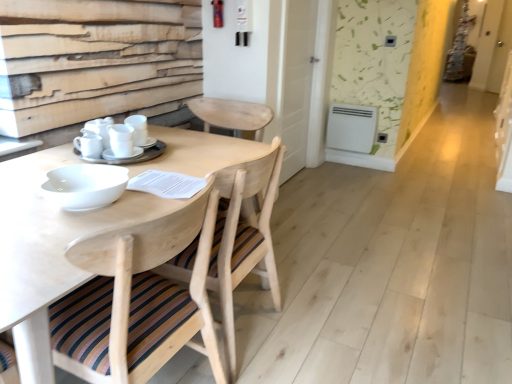
Describe the element at coordinates (138, 128) in the screenshot. I see `white matte cups at center, placed as the 1th tableware when sorted from right to left` at that location.

In order to face natural wood chair at center, which is the first chair from back to front, should I rotate leftwards or rightwards?

Turn left approximately 6.716 degrees to face it.

The width and height of the screenshot is (512, 384). Describe the element at coordinates (129, 157) in the screenshot. I see `white matte cups at center, which appears as the 2th tableware when viewed from the left` at that location.

Measure the distance between point (126, 252) and camera.

The distance of point (126, 252) from camera is 38.94 inches.

Where is `natural wood chair at center, which is counted as the second chair, starting from the back`? natural wood chair at center, which is counted as the second chair, starting from the back is located at coordinates (137, 299).

This screenshot has height=384, width=512. What do you see at coordinates (89, 144) in the screenshot?
I see `white glossy cup at center, placed as the 1th tableware when sorted from left to right` at bounding box center [89, 144].

Measure the distance between point (495, 16) and camera.

They are 7.25 meters apart.

Identify the location of natural wood round table at center. Image resolution: width=512 pixels, height=384 pixels. (50, 237).

Is natural wood chair at center, which is counted as the second chair, starting from the back, far away from white glossy cup at center, which is the 3th tableware in right-to-left order?

natural wood chair at center, which is counted as the second chair, starting from the back, is actually quite close to white glossy cup at center, which is the 3th tableware in right-to-left order.

Find the location of a particular element. The width and height of the screenshot is (512, 384). the 2nd chair in front of the white glossy cup at center, which is the 3th tableware in right-to-left order is located at coordinates (137, 299).

Is point (208, 230) positioned after point (90, 147)?

No, (208, 230) is in front of (90, 147).

Considering the sizes of objects natural wood chair at center, which is counted as the second chair, starting from the back, and white glossy cup at center, which is the 3th tableware in right-to-left order, in the image provided, who is wider, natural wood chair at center, which is counted as the second chair, starting from the back, or white glossy cup at center, which is the 3th tableware in right-to-left order,?

Wider between the two is natural wood chair at center, which is counted as the second chair, starting from the back.

From a real-world perspective, is white plastic radiator at center on top of white matte cups at center, which appears as the 2th tableware when viewed from the left?

No, from a real-world perspective, white plastic radiator at center is not over white matte cups at center, which appears as the 2th tableware when viewed from the left

What's the angular difference between white plastic radiator at center and white matte cups at center, which appears as the 2th tableware when viewed from the left,'s facing directions?

There is a 91.2-degree angle between the facing directions of white plastic radiator at center and white matte cups at center, which appears as the 2th tableware when viewed from the left.

From the image's perspective, between white plastic radiator at center and white matte cups at center, placed as the second tableware when sorted from right to left, which one is located above?

white plastic radiator at center appears higher in the image.

Image resolution: width=512 pixels, height=384 pixels. In order to click on round table located on the right of white glossy cup at center, which is the 3th tableware in right-to-left order in this screenshot , I will do `click(50, 237)`.

Is white glossy cup at center, placed as the 1th tableware when sorted from left to right, a part of natural wood round table at center?

That's incorrect, white glossy cup at center, placed as the 1th tableware when sorted from left to right, is not inside natural wood round table at center.

Looking at this image, in terms of size, does natural wood round table at center appear bigger or smaller than white glossy cup at center, which is the 3th tableware in right-to-left order?

Considering their sizes, natural wood round table at center takes up more space than white glossy cup at center, which is the 3th tableware in right-to-left order.

Which is more to the left, natural wood round table at center or white glossy cup at center, which is the 3th tableware in right-to-left order?

white glossy cup at center, which is the 3th tableware in right-to-left order, is more to the left.

How much distance is there between white glossy screen door at upper right and white matte cups at center, which appears as the 2th tableware when viewed from the left?

white glossy screen door at upper right and white matte cups at center, which appears as the 2th tableware when viewed from the left, are 7.58 meters apart.

Find the location of a particular element. This screenshot has width=512, height=384. tableware that is the 3rd object directly below the white glossy screen door at upper right (from a real-world perspective) is located at coordinates (129, 157).

In terms of height, does white glossy screen door at upper right look taller or shorter compared to white matte cups at center, which appears as the 2th tableware when viewed from the left?

In the image, white glossy screen door at upper right appears to be taller than white matte cups at center, which appears as the 2th tableware when viewed from the left.

Does white matte cups at center, which ranks as the 3th tableware in left-to-right order, turn towards natural wood chair at center, which is counted as the second chair, starting from the back?

No, white matte cups at center, which ranks as the 3th tableware in left-to-right order, does not turn towards natural wood chair at center, which is counted as the second chair, starting from the back.

Looking at this image, from the image's perspective, is white matte cups at center, placed as the 1th tableware when sorted from right to left, under natural wood chair at center, which is counted as the second chair, starting from the back?

Incorrect, from the image's perspective, white matte cups at center, placed as the 1th tableware when sorted from right to left, is higher than natural wood chair at center, which is counted as the second chair, starting from the back.

Between white matte cups at center, placed as the 1th tableware when sorted from right to left, and natural wood chair at center, which is counted as the second chair, starting from the back, which one has less height?

white matte cups at center, placed as the 1th tableware when sorted from right to left.

Considering the sizes of objects white matte cups at center, placed as the second tableware when sorted from right to left, and white plastic radiator at center in the image provided, who is thinner, white matte cups at center, placed as the second tableware when sorted from right to left, or white plastic radiator at center?

white plastic radiator at center is thinner.

Could you tell me if white matte cups at center, which appears as the 2th tableware when viewed from the left, is facing white plastic radiator at center?

No.

Is white matte cups at center, which appears as the 2th tableware when viewed from the left, next to white plastic radiator at center?

No, white matte cups at center, which appears as the 2th tableware when viewed from the left, is not making contact with white plastic radiator at center.

Is natural wood chair at center, the 1th chair from the front, facing away from white matte cups at center, placed as the second tableware when sorted from right to left?

natural wood chair at center, the 1th chair from the front, is not turned away from white matte cups at center, placed as the second tableware when sorted from right to left.

In the scene shown: Would you say white matte cups at center, which appears as the 2th tableware when viewed from the left, is part of natural wood chair at center, the 1th chair from the front,'s contents?

No, white matte cups at center, which appears as the 2th tableware when viewed from the left, is located outside of natural wood chair at center, the 1th chair from the front.

Looking at the image, does natural wood chair at center, the 1th chair from the front, seem bigger or smaller compared to white matte cups at center, which appears as the 2th tableware when viewed from the left?

In the image, natural wood chair at center, the 1th chair from the front, appears to be larger than white matte cups at center, which appears as the 2th tableware when viewed from the left.

The image size is (512, 384). Identify the location of the 2nd chair in front of the white glossy cup at center, placed as the 1th tableware when sorted from left to right, counting from the anchor's position. (137, 299).

Locate an element on the screen. appliance that is above the white matte cups at center, which appears as the 2th tableware when viewed from the left (from the image's perspective) is located at coordinates (351, 127).

When comparing their distances from natural wood chair at center, which is counted as the second chair, starting from the back, does natural wood round table at center or white glossy screen door at upper right seem further?

white glossy screen door at upper right.

Based on their spatial positions, is white matte cups at center, placed as the 1th tableware when sorted from right to left, or white glossy cup at center, placed as the 1th tableware when sorted from left to right, further from natural wood round table at center?

white matte cups at center, placed as the 1th tableware when sorted from right to left, is further to natural wood round table at center.

In the scene shown: Which object lies further to the anchor point white glossy cup at center, placed as the 1th tableware when sorted from left to right, white glossy screen door at upper right or white matte cups at center, which ranks as the 3th tableware in left-to-right order?

The object further to white glossy cup at center, placed as the 1th tableware when sorted from left to right, is white glossy screen door at upper right.

Estimate the real-world distances between objects in this image. Which object is further from natural wood chair at center, which is the second chair from front to back, natural wood chair at center, which is counted as the second chair, starting from the back, or white plastic radiator at center?

white plastic radiator at center is positioned further to the anchor natural wood chair at center, which is the second chair from front to back.

Looking at this image, when comparing their distances from white glossy screen door at upper right, does natural wood chair at center, which is counted as the second chair, starting from the back, or white glossy cup at center, placed as the 1th tableware when sorted from left to right, seem closer?

white glossy cup at center, placed as the 1th tableware when sorted from left to right, lies closer to white glossy screen door at upper right than the other object.

Looking at the image, which one is located closer to white glossy screen door at upper right, white glossy cup at center, which is the 3th tableware in right-to-left order, or natural wood chair at center, which is the first chair from back to front?

Result: natural wood chair at center, which is the first chair from back to front.

Estimate the real-world distances between objects in this image. Which object is closer to natural wood chair at center, which is counted as the second chair, starting from the back, white matte cups at center, placed as the 1th tableware when sorted from right to left, or white matte cups at center, which appears as the 2th tableware when viewed from the left?

white matte cups at center, which appears as the 2th tableware when viewed from the left, lies closer to natural wood chair at center, which is counted as the second chair, starting from the back, than the other object.

Which object lies nearer to the anchor point white glossy screen door at upper right, natural wood round table at center or natural wood chair at center, which is counted as the second chair, starting from the back?

Based on the image, natural wood round table at center appears to be nearer to white glossy screen door at upper right.

Find the location of a particular element. This screenshot has height=384, width=512. tableware located between white glossy cup at center, which is the 3th tableware in right-to-left order, and white glossy screen door at upper right in the depth direction is located at coordinates (138, 128).

Identify the location of appliance between natural wood chair at center, which is counted as the second chair, starting from the back, and white glossy screen door at upper right from front to back. tap(351, 127).

Locate an element on the screen. The image size is (512, 384). appliance between white glossy cup at center, which is the 3th tableware in right-to-left order, and white glossy screen door at upper right, along the z-axis is located at coordinates (351, 127).

You are a GUI agent. You are given a task and a screenshot of the screen. Output one action in this format:
    pyautogui.click(x=<x>, y=<y>)
    Task: Click on the chair positioned between natural wood round table at center and natural wood chair at center, which is the first chair from back to front, from near to far
    
    Given the screenshot: What is the action you would take?
    pyautogui.click(x=137, y=299)